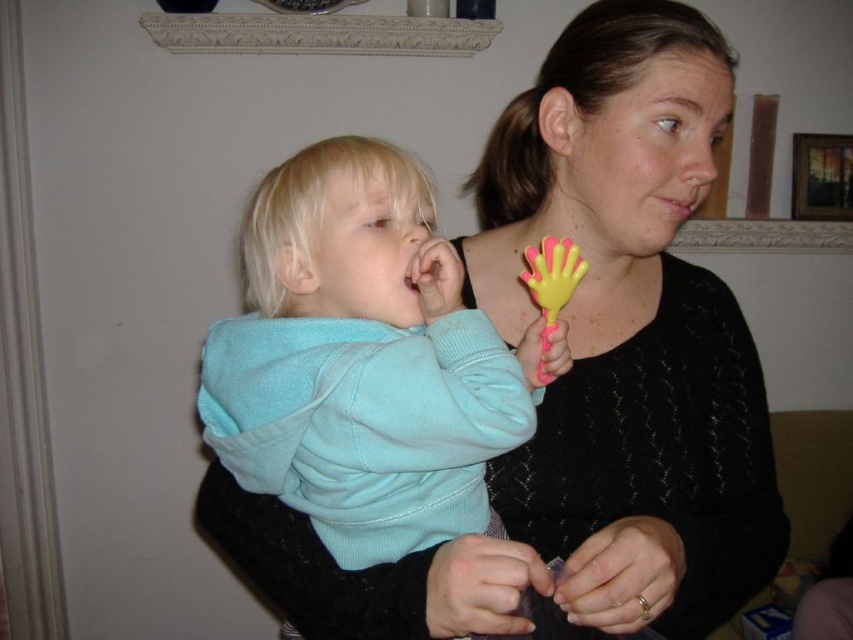
You are a fashion designer who needs to determine if the matte black sweater at center can fit into a display case that is exactly the same width as the yellow rubber toy at center. Based on the scene, will the sweater fit?

The matte black sweater at center is wider than the yellow rubber toy at center, so it will not fit into the display case designed for the toy.

You are a photographer trying to capture a closeup of the yellow rubber toy at center without the matte black sweater at center blocking it. Based on the scene, can you position yourself in a way to avoid the sweater blocking the view?

The matte black sweater at center is closer to the viewer than the yellow rubber toy at center. To avoid the sweater blocking the view, you would need to adjust your position so that the yellow rubber toy at center is no longer behind the sweater. However, since both are at center, moving sideways might be necessary to shift the perspective and frame the toy without obstruction.

You are a photographer trying to capture a closeup of the child in the scene. The child is represented by the point at coordinates point (x=357, y=250) and the woman is represented by the point at coordinates point (x=544, y=300). Which point should you focus on to ensure the child is in focus?

You should focus on point (x=357, y=250) because it is closer to the camera than point (x=544, y=300), ensuring the child is in focus.